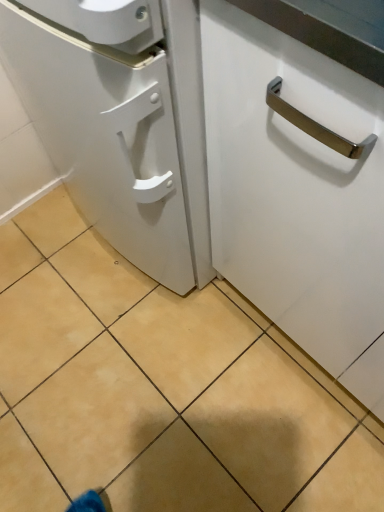
Question: Should I look upward or downward to see beige tile at center?

Choices:
 (A) down
 (B) up

Answer: (A)

Question: Can you confirm if white glossy cabinet handle at center is taller than beige tile at center?

Choices:
 (A) yes
 (B) no

Answer: (A)

Question: From the image's perspective, is white glossy cabinet handle at center on top of beige tile at center?

Choices:
 (A) no
 (B) yes

Answer: (B)

Question: Is white glossy cabinet handle at center at the right side of beige tile at center?

Choices:
 (A) yes
 (B) no

Answer: (A)

Question: Does white glossy cabinet handle at center have a larger size compared to beige tile at center?

Choices:
 (A) no
 (B) yes

Answer: (B)

Question: From a real-world perspective, is white glossy cabinet handle at center beneath beige tile at center?

Choices:
 (A) no
 (B) yes

Answer: (A)

Question: Would you consider white glossy cabinet handle at center to be distant from beige tile at center?

Choices:
 (A) no
 (B) yes

Answer: (A)

Question: From a real-world perspective, is beige tile at center under white glossy cabinet handle at center?

Choices:
 (A) no
 (B) yes

Answer: (B)

Question: Considering the relative sizes of beige tile at center and white glossy cabinet handle at center in the image provided, is beige tile at center taller than white glossy cabinet handle at center?

Choices:
 (A) no
 (B) yes

Answer: (A)

Question: Does beige tile at center come behind white glossy cabinet handle at center?

Choices:
 (A) no
 (B) yes

Answer: (B)

Question: Is beige tile at center touching white glossy cabinet handle at center?

Choices:
 (A) no
 (B) yes

Answer: (A)

Question: From a real-world perspective, is beige tile at center physically above white glossy cabinet handle at center?

Choices:
 (A) no
 (B) yes

Answer: (A)

Question: Does beige tile at center turn towards white glossy cabinet handle at center?

Choices:
 (A) yes
 (B) no

Answer: (B)

Question: Based on their sizes in the image, would you say white glossy cabinet handle at center is bigger or smaller than beige tile at center?

Choices:
 (A) big
 (B) small

Answer: (A)